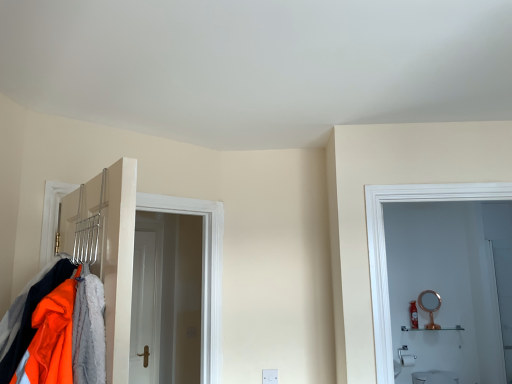
Question: From the image's perspective, would you say rose gold metallic mirror at right is shown under white glossy shelf at right?

Choices:
 (A) no
 (B) yes

Answer: (A)

Question: Considering the relative positions of rose gold metallic mirror at right and white glossy shelf at right in the image provided, is rose gold metallic mirror at right to the left of white glossy shelf at right from the viewer's perspective?

Choices:
 (A) yes
 (B) no

Answer: (B)

Question: Is rose gold metallic mirror at right beside white glossy shelf at right?

Choices:
 (A) no
 (B) yes

Answer: (A)

Question: From the image's perspective, is rose gold metallic mirror at right on top of white glossy shelf at right?

Choices:
 (A) yes
 (B) no

Answer: (A)

Question: Considering the relative sizes of rose gold metallic mirror at right and white glossy shelf at right in the image provided, is rose gold metallic mirror at right shorter than white glossy shelf at right?

Choices:
 (A) yes
 (B) no

Answer: (B)

Question: Is rose gold metallic mirror at right wider or thinner than white glossy shelf at right?

Choices:
 (A) wide
 (B) thin

Answer: (B)

Question: Considering the relative positions of rose gold metallic mirror at right and white glossy shelf at right in the image provided, is rose gold metallic mirror at right to the left or to the right of white glossy shelf at right?

Choices:
 (A) right
 (B) left

Answer: (A)

Question: Based on their sizes in the image, would you say rose gold metallic mirror at right is bigger or smaller than white glossy shelf at right?

Choices:
 (A) small
 (B) big

Answer: (A)

Question: Is point (424, 309) closer or farther from the camera than point (461, 329)?

Choices:
 (A) farther
 (B) closer

Answer: (A)

Question: From their relative heights in the image, would you say metallic silver coat rack at left is taller or shorter than white glossy shelf at right?

Choices:
 (A) tall
 (B) short

Answer: (A)

Question: Is metallic silver coat rack at left to the left or to the right of white glossy shelf at right in the image?

Choices:
 (A) right
 (B) left

Answer: (B)

Question: Considering the positions of metallic silver coat rack at left and white glossy shelf at right in the image, is metallic silver coat rack at left wider or thinner than white glossy shelf at right?

Choices:
 (A) thin
 (B) wide

Answer: (B)

Question: Is metallic silver coat rack at left bigger or smaller than white glossy shelf at right?

Choices:
 (A) big
 (B) small

Answer: (A)

Question: Considering their positions, is white glossy shelf at right located in front of or behind rose gold metallic mirror at right?

Choices:
 (A) behind
 (B) front

Answer: (B)

Question: Is point (435, 327) positioned closer to the camera than point (431, 321)?

Choices:
 (A) farther
 (B) closer

Answer: (B)